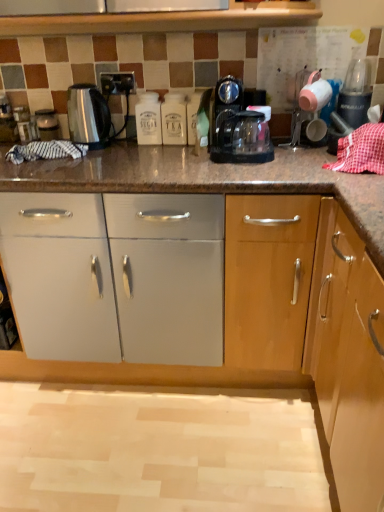
Question: Considering their positions, is white matte sugar container at center, positioned as the 2th bottle in right-to-left order, located in front of or behind satin silver kettle at left?

Choices:
 (A) front
 (B) behind

Answer: (A)

Question: Is white matte sugar container at center, positioned as the 2th bottle in right-to-left order, wider or thinner than satin silver kettle at left?

Choices:
 (A) wide
 (B) thin

Answer: (B)

Question: Which object is the farthest from the white matte sugar container at center, positioned as the 2th bottle in right-to-left order?

Choices:
 (A) satin silver kettle at left
 (B) transparent plastic coffee maker at center
 (C) white plastic tea container at center, which ranks as the first bottle in right-to-left order
 (D) satin silver kettle at left
 (E) metallic socket at upper center

Answer: (D)

Question: Which is nearer to the satin silver kettle at left?

Choices:
 (A) satin silver kettle at left
 (B) transparent plastic coffee maker at center
 (C) metallic socket at upper center
 (D) white matte sugar container at center, positioned as the 2th bottle in right-to-left order
 (E) white plastic tea container at center, the 2th bottle positioned from the left

Answer: (A)